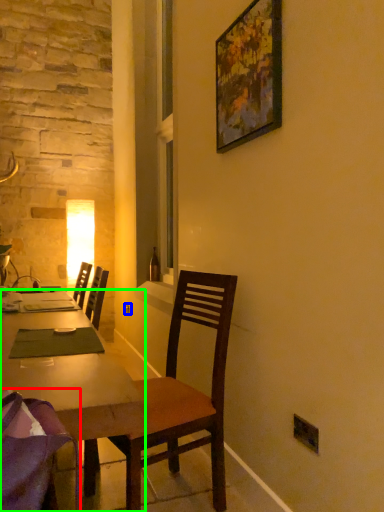
Question: Which object is positioned farthest from chair (highlighted by a red box)? Select from power outlet (highlighted by a blue box) and desk (highlighted by a green box).

Choices:
 (A) power outlet
 (B) desk

Answer: (A)